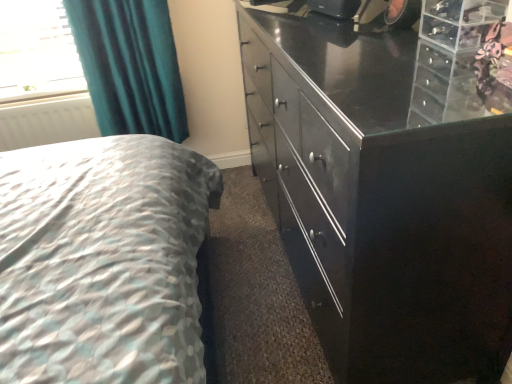
The image size is (512, 384). Describe the element at coordinates (386, 193) in the screenshot. I see `glossy black cabinet at right` at that location.

Describe the element at coordinates (130, 66) in the screenshot. I see `teal fabric curtain at upper left` at that location.

Identify the location of white matte radiator at left. (47, 121).

From a real-world perspective, does glossy black cabinet at right sit lower than white matte radiator at left?

Incorrect, from a real-world perspective, glossy black cabinet at right is higher than white matte radiator at left.

Which of these two, glossy black cabinet at right or white matte radiator at left, stands shorter?

With less height is white matte radiator at left.

Based on their sizes in the image, would you say glossy black cabinet at right is bigger or smaller than white matte radiator at left?

Considering their sizes, glossy black cabinet at right takes up more space than white matte radiator at left.

Locate an element on the screen. The width and height of the screenshot is (512, 384). chest of drawers that appears on the right of white matte radiator at left is located at coordinates (386, 193).

From the image's perspective, who appears lower, glossy black cabinet at right or teal fabric curtain at upper left?

glossy black cabinet at right appears lower in the image.

Would you say teal fabric curtain at upper left is part of glossy black cabinet at right's contents?

No, teal fabric curtain at upper left is not inside glossy black cabinet at right.

How many degrees apart are the facing directions of glossy black cabinet at right and teal fabric curtain at upper left?

88.5 degrees separate the facing orientations of glossy black cabinet at right and teal fabric curtain at upper left.

The width and height of the screenshot is (512, 384). I want to click on the chest of drawers below the teal fabric curtain at upper left (from a real-world perspective), so click(x=386, y=193).

Are teal fabric curtain at upper left and white matte radiator at left beside each other?

teal fabric curtain at upper left and white matte radiator at left are clearly separated.

Considering the positions of objects teal fabric curtain at upper left and white matte radiator at left in the image provided, who is more to the right, teal fabric curtain at upper left or white matte radiator at left?

From the viewer's perspective, teal fabric curtain at upper left appears more on the right side.

Locate an element on the screen. curtain on the right of white matte radiator at left is located at coordinates (130, 66).

Based on the photo, can you confirm if teal fabric curtain at upper left is smaller than white matte radiator at left?

No, teal fabric curtain at upper left is not smaller than white matte radiator at left.

Which of these two, teal fabric curtain at upper left or glossy black cabinet at right, is wider?

glossy black cabinet at right is wider.

Is teal fabric curtain at upper left not within glossy black cabinet at right?

Yes, teal fabric curtain at upper left is not within glossy black cabinet at right.

Which of these two, teal fabric curtain at upper left or glossy black cabinet at right, is bigger?

Bigger between the two is glossy black cabinet at right.

Considering the sizes of objects white matte radiator at left and teal fabric curtain at upper left in the image provided, who is bigger, white matte radiator at left or teal fabric curtain at upper left?

teal fabric curtain at upper left.

Considering the sizes of objects white matte radiator at left and teal fabric curtain at upper left in the image provided, who is wider, white matte radiator at left or teal fabric curtain at upper left?

With larger width is teal fabric curtain at upper left.

Does white matte radiator at left have a lesser height compared to teal fabric curtain at upper left?

Yes, white matte radiator at left is shorter than teal fabric curtain at upper left.

Is white matte radiator at left placed right next to teal fabric curtain at upper left?

No, white matte radiator at left is not next to teal fabric curtain at upper left.

Looking at this image, from the image's perspective, is white matte radiator at left above glossy black cabinet at right?

Yes.

Is white matte radiator at left to the left of glossy black cabinet at right from the viewer's perspective?

Yes, white matte radiator at left is to the left of glossy black cabinet at right.

From a real-world perspective, between white matte radiator at left and glossy black cabinet at right, who is vertically higher?

glossy black cabinet at right, from a real-world perspective.

There is a white matte radiator at left. Where is `the chest of drawers above it (from a real-world perspective)`? The image size is (512, 384). the chest of drawers above it (from a real-world perspective) is located at coordinates (386, 193).

The image size is (512, 384). I want to click on chest of drawers below the teal fabric curtain at upper left (from the image's perspective), so click(386, 193).

In the scene shown: Considering their positions, is white matte radiator at left positioned closer to teal fabric curtain at upper left than glossy black cabinet at right?

white matte radiator at left lies closer to teal fabric curtain at upper left than the other object.

Based on their spatial positions, is teal fabric curtain at upper left or glossy black cabinet at right further from white matte radiator at left?

Among the two, glossy black cabinet at right is located further to white matte radiator at left.

Estimate the real-world distances between objects in this image. Which object is further from glossy black cabinet at right, teal fabric curtain at upper left or white matte radiator at left?

white matte radiator at left is positioned further to the anchor glossy black cabinet at right.

Based on their spatial positions, is glossy black cabinet at right or teal fabric curtain at upper left closer to white matte radiator at left?

Based on the image, teal fabric curtain at upper left appears to be nearer to white matte radiator at left.

When comparing their distances from teal fabric curtain at upper left, does glossy black cabinet at right or white matte radiator at left seem closer?

The object closer to teal fabric curtain at upper left is white matte radiator at left.

Looking at the image, which one is located further to glossy black cabinet at right, white matte radiator at left or teal fabric curtain at upper left?

The object further to glossy black cabinet at right is white matte radiator at left.

Where is `curtain between glossy black cabinet at right and white matte radiator at left from front to back`? This screenshot has height=384, width=512. curtain between glossy black cabinet at right and white matte radiator at left from front to back is located at coordinates (130, 66).